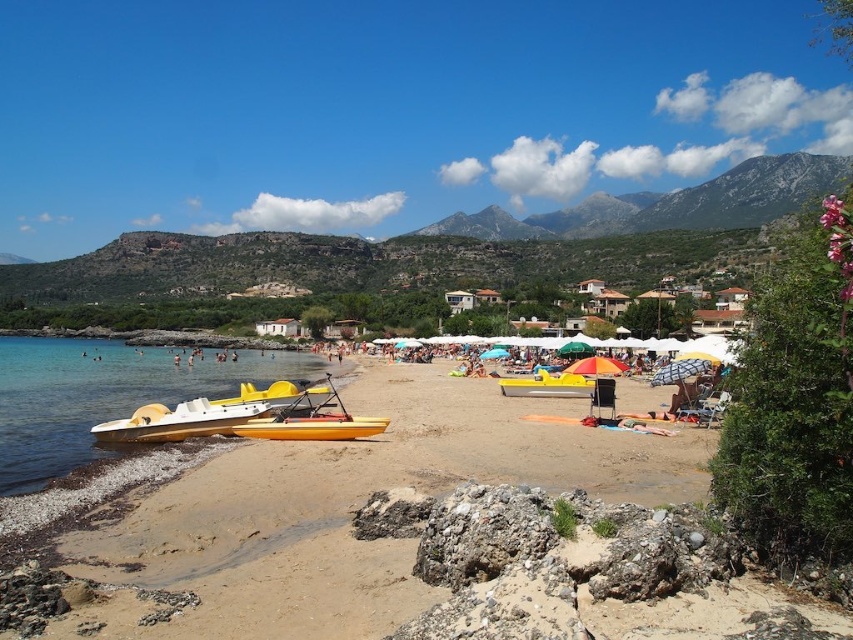
Which is in front, point (264, 428) or point (555, 380)?

Point (264, 428) is more forward.

You are a GUI agent. You are given a task and a screenshot of the screen. Output one action in this format:
    pyautogui.click(x=<x>, y=<y>)
    Task: Click on the yellow matte kayak at lower center
    This screenshot has height=640, width=853.
    Given the screenshot: What is the action you would take?
    pyautogui.click(x=312, y=428)

Can you confirm if yellow plastic watercraft at lower left is positioned above yellow plastic boat at center?

Yes, yellow plastic watercraft at lower left is above yellow plastic boat at center.

Can you confirm if yellow plastic watercraft at lower left is positioned to the right of yellow plastic boat at center?

No, yellow plastic watercraft at lower left is not to the right of yellow plastic boat at center.

Which is behind, point (21, 404) or point (556, 378)?

Point (556, 378)

Locate an element on the screen. This screenshot has width=853, height=640. yellow plastic watercraft at lower left is located at coordinates (105, 397).

Which is in front, point (402, 465) or point (157, 404)?

Point (402, 465) is in front.

Is yellow sand at lower left smaller than yellow matte kayak at lower left?

Answer: No, yellow sand at lower left is not smaller than yellow matte kayak at lower left.

Who is more forward, (x=354, y=492) or (x=213, y=426)?

Point (x=354, y=492)

The width and height of the screenshot is (853, 640). I want to click on yellow sand at lower left, so click(x=350, y=509).